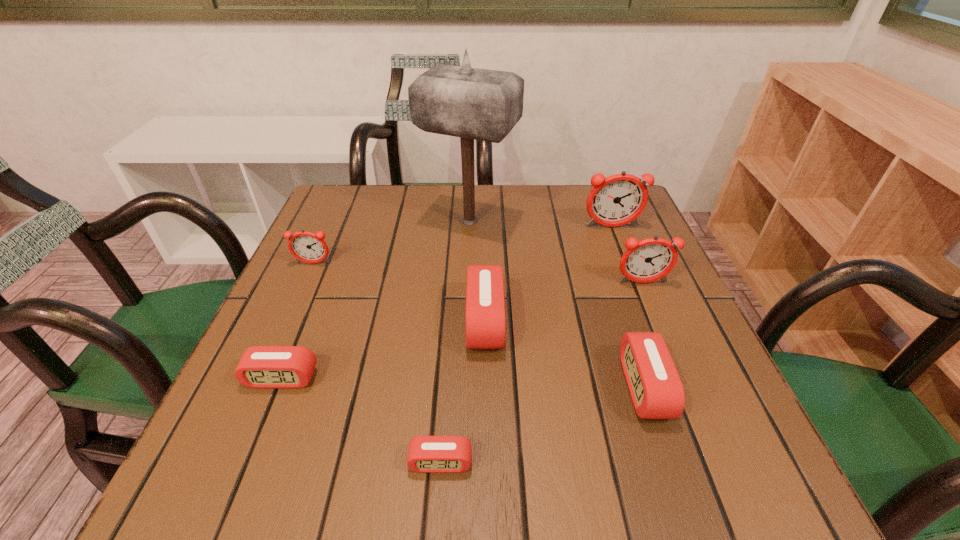
At what (x,y) coordinates should I click in order to perform the action: click on vacant space located 0.360m on the front-facing side of the biggest pink alarm clock. Please return your answer as a coordinate pair (x, y). This screenshot has width=960, height=540. Looking at the image, I should click on (279, 321).

This screenshot has width=960, height=540. I want to click on vacant space located 0.250m on the front-facing side of the third shortest object, so click(477, 387).

Locate an element on the screen. free region located 0.140m on the front-facing side of the third shortest object is located at coordinates (542, 387).

Image resolution: width=960 pixels, height=540 pixels. Identify the location of vacant region located on the front-facing side of the third shortest object. (489, 387).

Find the location of a particular element. free location located 0.150m on the front-facing side of the third biggest pink alarm clock is located at coordinates (240, 480).

Image resolution: width=960 pixels, height=540 pixels. What are the coordinates of `mallet that is at the far edge` in the screenshot? It's located at (475, 104).

Image resolution: width=960 pixels, height=540 pixels. Find the location of `alarm clock at the far edge`. alarm clock at the far edge is located at coordinates (619, 199).

Find the location of a particular element. object that is at the near edge is located at coordinates (426, 454).

What are the coordinates of `object situated at the far right corner` in the screenshot? It's located at (619, 199).

Identify the location of vacant space at the far edge of the desktop. The height and width of the screenshot is (540, 960). (558, 219).